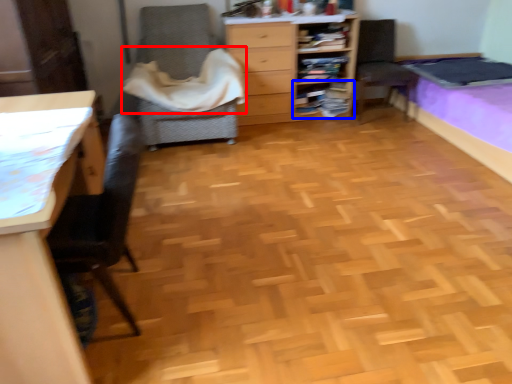
Question: Which object is closer to the camera taking this photo, blanket (highlighted by a red box) or shelf (highlighted by a blue box)?

Choices:
 (A) blanket
 (B) shelf

Answer: (A)